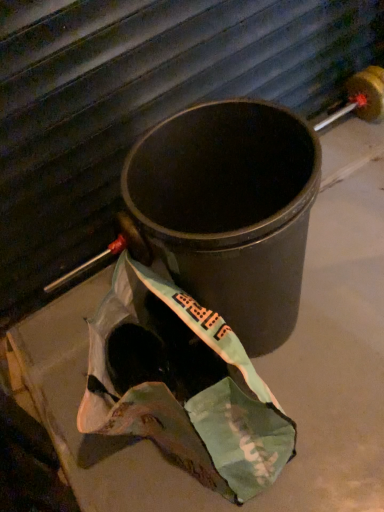
Question: Visually, is black matte trash can at center positioned to the left or to the right of teal fabric grocery bag at center?

Choices:
 (A) right
 (B) left

Answer: (A)

Question: In terms of size, does black matte trash can at center appear bigger or smaller than teal fabric grocery bag at center?

Choices:
 (A) big
 (B) small

Answer: (A)

Question: In terms of height, does black matte trash can at center look taller or shorter compared to teal fabric grocery bag at center?

Choices:
 (A) tall
 (B) short

Answer: (A)

Question: Considering the positions of teal fabric grocery bag at center and black matte trash can at center in the image, is teal fabric grocery bag at center wider or thinner than black matte trash can at center?

Choices:
 (A) thin
 (B) wide

Answer: (A)

Question: From a real-world perspective, is teal fabric grocery bag at center above or below black matte trash can at center?

Choices:
 (A) above
 (B) below

Answer: (B)

Question: Which is correct: teal fabric grocery bag at center is inside black matte trash can at center, or outside of it?

Choices:
 (A) outside
 (B) inside

Answer: (A)

Question: Relative to black matte trash can at center, is teal fabric grocery bag at center in front or behind?

Choices:
 (A) behind
 (B) front

Answer: (B)